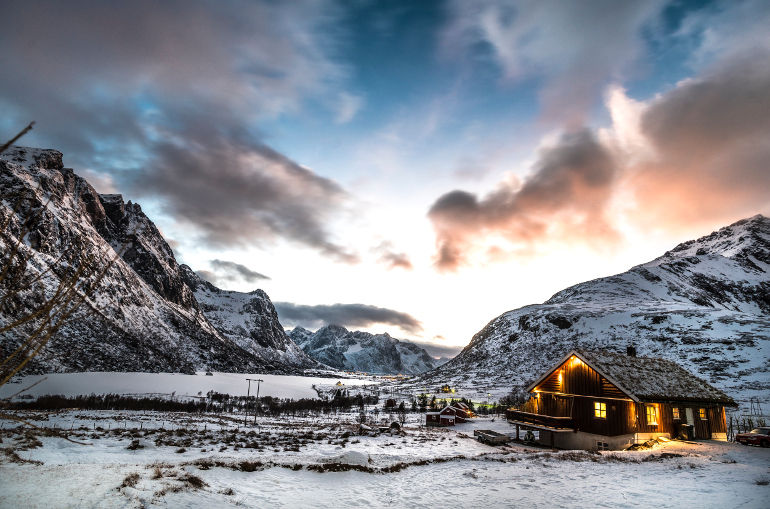
Image resolution: width=770 pixels, height=509 pixels. What are the coordinates of `basement window` in the screenshot? It's located at (x=598, y=445).